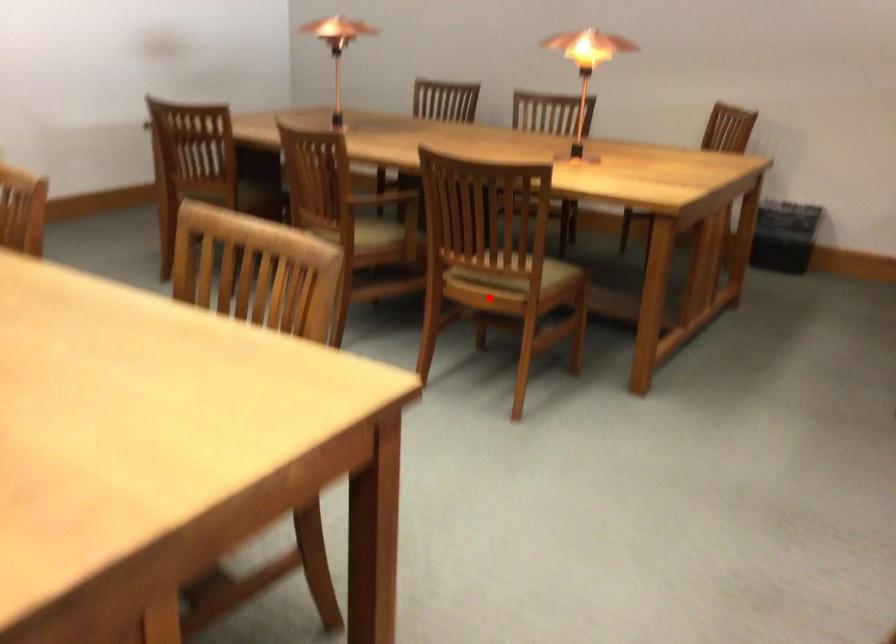
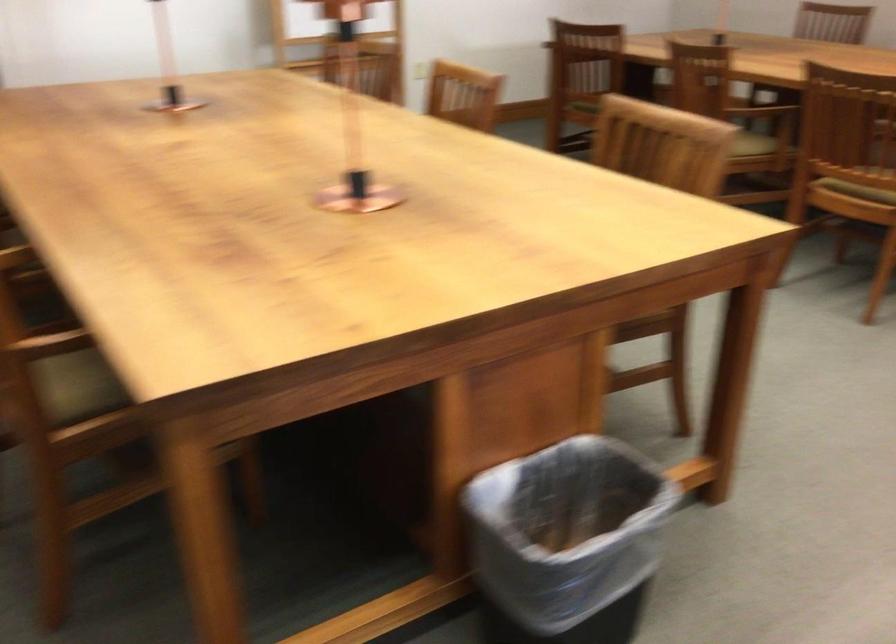
Locate, in the second image, the point that corresponds to the highlighted location in the first image.

(857, 191)